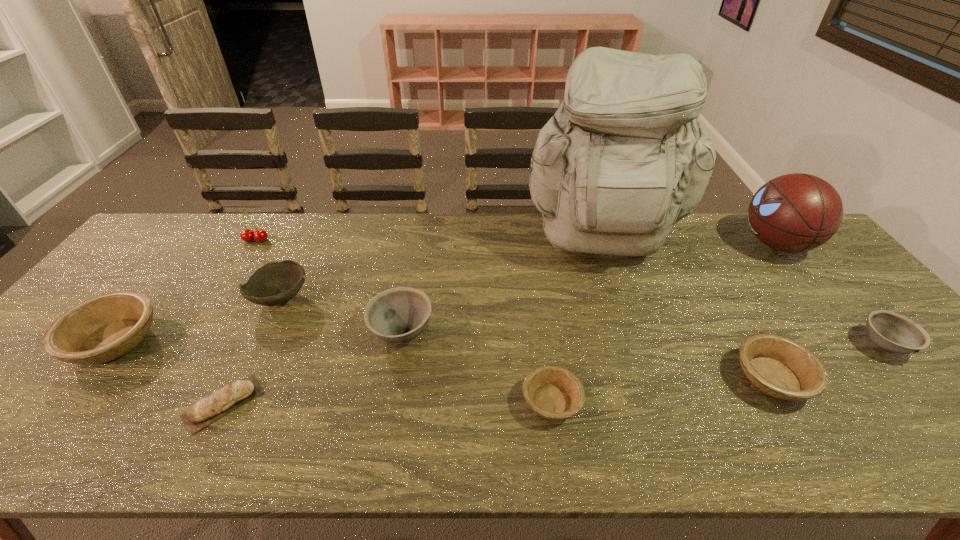
You are a GUI agent. You are given a task and a screenshot of the screen. Output one action in this format:
    pyautogui.click(x=<x>, y=<y>)
    Task: Click on the vacant space in between the eighth shortest object and the tallest object
    Image resolution: width=960 pixels, height=540 pixels.
    Given the screenshot: What is the action you would take?
    click(x=428, y=243)

The height and width of the screenshot is (540, 960). I want to click on unoccupied position between the red cherry and the backpack, so point(428,243).

Locate an element on the screen. This screenshot has height=540, width=960. vacant space in between the leftmost beige bowl and the fifth bowl from right to left is located at coordinates (198, 320).

The image size is (960, 540). Identify the location of vacant point located between the shortest bowl and the fourth bowl from right to left. (477, 367).

Where is `free space between the second bowl from left to right and the fifth object from left to right`? The width and height of the screenshot is (960, 540). free space between the second bowl from left to right and the fifth object from left to right is located at coordinates (342, 315).

Find the location of a particular element. This screenshot has width=960, height=540. free point between the fifth bowl from right to left and the second bowl from right to left is located at coordinates (527, 339).

Where is `vacant point located between the second beige bowl from left to right and the leftmost beige bowl`? vacant point located between the second beige bowl from left to right and the leftmost beige bowl is located at coordinates [x=333, y=372].

Where is `the sixth closest object to the smallest beige bowl`? The width and height of the screenshot is (960, 540). the sixth closest object to the smallest beige bowl is located at coordinates (797, 212).

Identify which object is located as the eighth nearest to the left gray bowl. Please provide its 2D coordinates. Your answer should be formatted as a tuple, i.e. [(x, y)], where the tuple contains the x and y coordinates of a point satisfying the conditions above.

[(797, 212)]

You are a GUI agent. You are given a task and a screenshot of the screen. Output one action in this format:
    pyautogui.click(x=<x>, y=<y>)
    Task: Click on the fifth closest bowl to the rightmost bowl
    The image size is (960, 540).
    Given the screenshot: What is the action you would take?
    pyautogui.click(x=103, y=328)